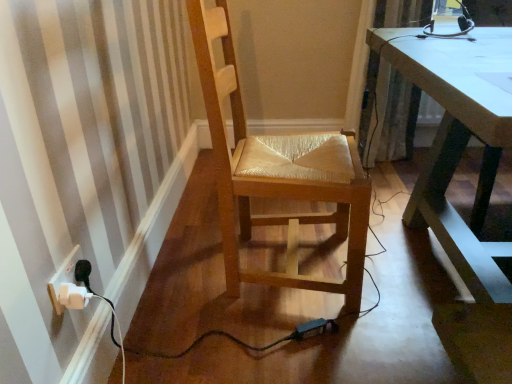
Locate an element on the screen. This screenshot has height=384, width=512. free space in front of wooden woven seat at center is located at coordinates 286,345.